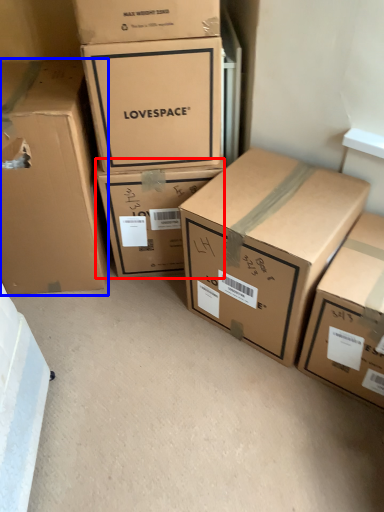
Question: Which object is closer to the camera taking this photo, box (highlighted by a red box) or box (highlighted by a blue box)?

Choices:
 (A) box
 (B) box

Answer: (B)